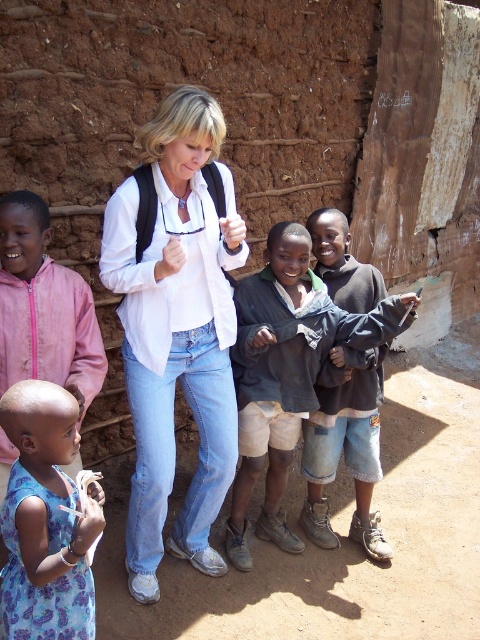
Question: Which of the following is the farthest from the observer?

Choices:
 (A) (41, 525)
 (B) (354, 454)

Answer: (B)

Question: Which point appears farthest from the camera in this image?

Choices:
 (A) coord(315,445)
 (B) coord(58,342)
 (C) coord(303,262)

Answer: (A)

Question: Is white matte shirt at center positioned at the back of dark gray fabric jacket at center?

Choices:
 (A) yes
 (B) no

Answer: (B)

Question: Which object is the farthest from the blue printed dress at lower left?

Choices:
 (A) denim shorts at center
 (B) blue floral dress at lower left

Answer: (A)

Question: Can you confirm if blue floral dress at lower left is thinner than denim shorts at center?

Choices:
 (A) yes
 (B) no

Answer: (A)

Question: Does denim shorts at center have a lesser width compared to blue printed dress at lower left?

Choices:
 (A) no
 (B) yes

Answer: (A)